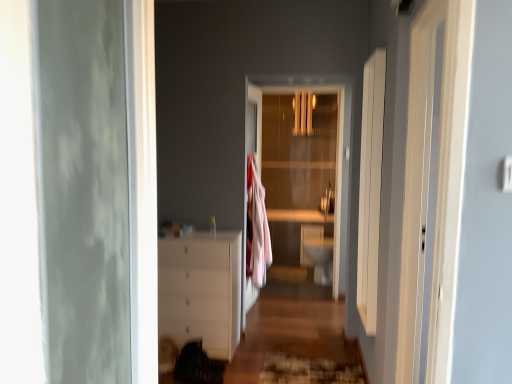
Question: From the image's perspective, is white glossy toilet bowl at center located above transparent glass door at center?

Choices:
 (A) yes
 (B) no

Answer: (B)

Question: Is white glossy toilet bowl at center oriented towards transparent glass door at center?

Choices:
 (A) yes
 (B) no

Answer: (B)

Question: From a real-world perspective, does white glossy toilet bowl at center stand above transparent glass door at center?

Choices:
 (A) yes
 (B) no

Answer: (B)

Question: Considering the relative sizes of white glossy toilet bowl at center and transparent glass door at center in the image provided, is white glossy toilet bowl at center taller than transparent glass door at center?

Choices:
 (A) yes
 (B) no

Answer: (B)

Question: Is white glossy toilet bowl at center far away from transparent glass door at center?

Choices:
 (A) no
 (B) yes

Answer: (B)

Question: Is white glossy dresser at lower left inside the boundaries of white glossy toilet bowl at center, or outside?

Choices:
 (A) outside
 (B) inside

Answer: (A)

Question: In terms of size, does white glossy dresser at lower left appear bigger or smaller than white glossy toilet bowl at center?

Choices:
 (A) big
 (B) small

Answer: (A)

Question: In the image, is white glossy dresser at lower left positioned in front of or behind white glossy toilet bowl at center?

Choices:
 (A) behind
 (B) front

Answer: (B)

Question: From the image's perspective, relative to white glossy toilet bowl at center, is white glossy dresser at lower left above or below?

Choices:
 (A) below
 (B) above

Answer: (A)

Question: From the image's perspective, is white glossy toilet bowl at center above or below textured brown rug at lower center?

Choices:
 (A) below
 (B) above

Answer: (B)

Question: Is white glossy toilet bowl at center to the left or to the right of textured brown rug at lower center in the image?

Choices:
 (A) right
 (B) left

Answer: (A)

Question: Considering the positions of white glossy toilet bowl at center and textured brown rug at lower center in the image, is white glossy toilet bowl at center taller or shorter than textured brown rug at lower center?

Choices:
 (A) short
 (B) tall

Answer: (B)

Question: Is white glossy toilet bowl at center bigger or smaller than textured brown rug at lower center?

Choices:
 (A) small
 (B) big

Answer: (B)

Question: Is transparent glass door at center in front of or behind textured brown rug at lower center in the image?

Choices:
 (A) front
 (B) behind

Answer: (B)

Question: Is transparent glass door at center bigger or smaller than textured brown rug at lower center?

Choices:
 (A) small
 (B) big

Answer: (B)